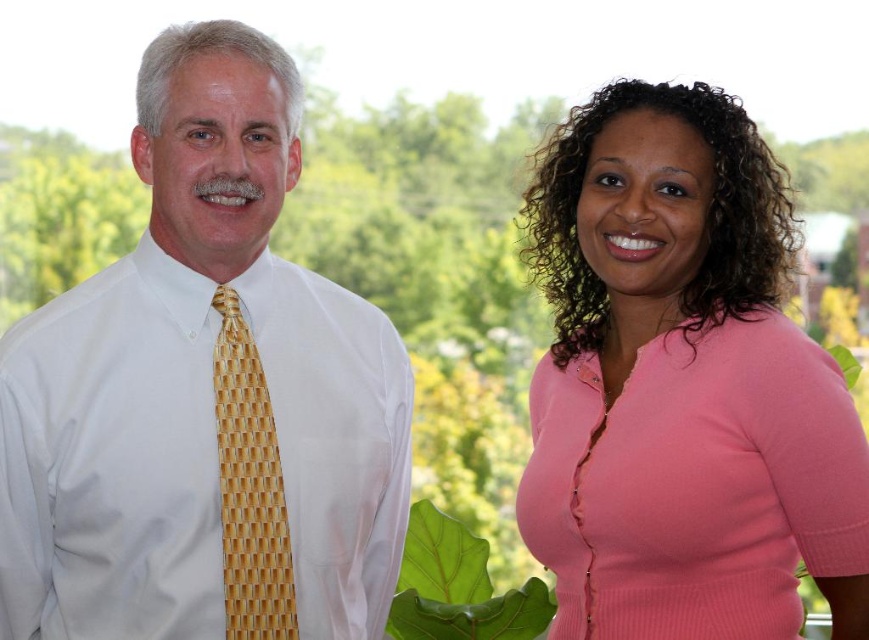
Between white woven tie at left and yellow woven tie at left, which one has more height?

With more height is white woven tie at left.

Does white woven tie at left have a greater height compared to yellow woven tie at left?

Indeed, white woven tie at left has a greater height compared to yellow woven tie at left.

The height and width of the screenshot is (640, 869). I want to click on white woven tie at left, so click(x=204, y=396).

Locate an element on the screen. white woven tie at left is located at coordinates (204, 396).

Who is positioned more to the right, pink ribbed sweater at right or green leafy plant at lower center?

pink ribbed sweater at right

Is pink ribbed sweater at right above green leafy plant at lower center?

Yes, pink ribbed sweater at right is above green leafy plant at lower center.

The image size is (869, 640). What do you see at coordinates (682, 385) in the screenshot?
I see `pink ribbed sweater at right` at bounding box center [682, 385].

Where is `pink ribbed sweater at right`? pink ribbed sweater at right is located at coordinates (682, 385).

Is pink ribbed sweater at right bigger than yellow woven tie at left?

Indeed, pink ribbed sweater at right has a larger size compared to yellow woven tie at left.

Can you confirm if pink ribbed sweater at right is positioned below yellow woven tie at left?

No, pink ribbed sweater at right is not below yellow woven tie at left.

This screenshot has height=640, width=869. What do you see at coordinates (682, 385) in the screenshot? I see `pink ribbed sweater at right` at bounding box center [682, 385].

You are a GUI agent. You are given a task and a screenshot of the screen. Output one action in this format:
    pyautogui.click(x=<x>, y=<y>)
    Task: Click on the pink ribbed sweater at right
    The height and width of the screenshot is (640, 869).
    Given the screenshot: What is the action you would take?
    pyautogui.click(x=682, y=385)